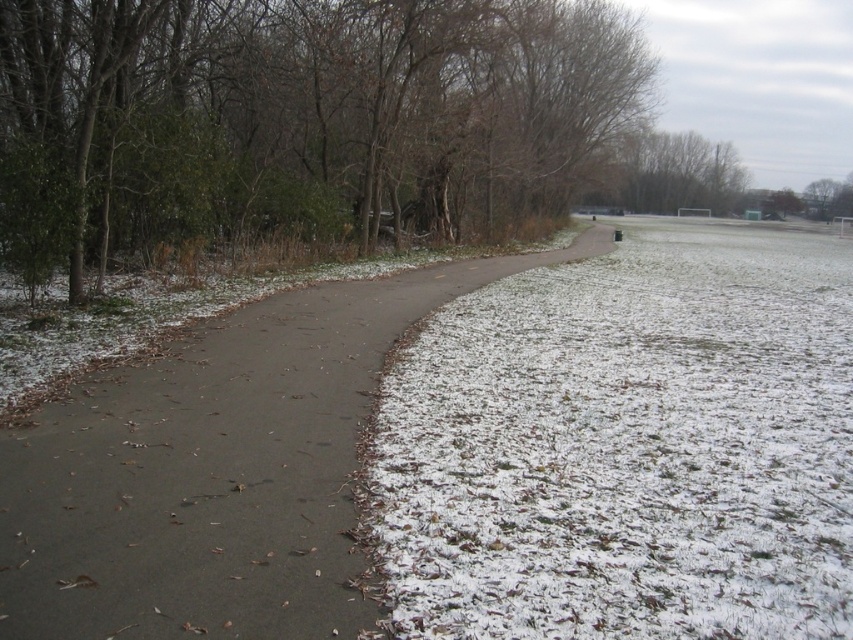
You are standing on the sandy brown asphalt path at center and want to take a photo of the green matte tree at left. To ensure the tree fits entirely in the frame, should you zoom in or zoom out your camera?

The green matte tree at left is taller than the sandy brown asphalt path at center. Since the tree is taller, you should zoom out to capture its full height in the photo.

You are standing at the point marked as point (300, 118) in the winter scene. Based on the description, what is the immediate environment around this point?

The point (300, 118) is on a green matte tree at left, which is part of the dense greenery including shrubs and small trees on the left side of the curved pathway.